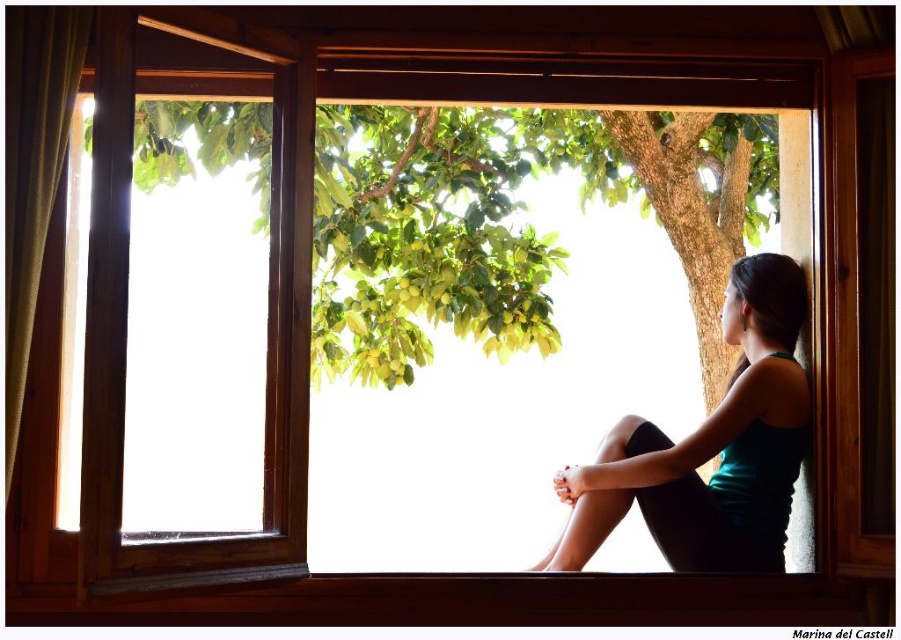
Who is higher up, green leafy tree at center or green textured curtain at left?

green leafy tree at center is higher up.

Is green leafy tree at center closer to the viewer compared to green textured curtain at left?

No, green leafy tree at center is behind green textured curtain at left.

Where is `green leafy tree at center`? The height and width of the screenshot is (640, 901). green leafy tree at center is located at coordinates pyautogui.click(x=512, y=224).

Between green leafy tree at center and teal fabric tank top at right, which one has less height?

teal fabric tank top at right is shorter.

Is green leafy tree at center shorter than teal fabric tank top at right?

No.

At what (x,y) coordinates should I click in order to perform the action: click on green leafy tree at center. Please return your answer as a coordinate pair (x, y). The height and width of the screenshot is (640, 901). Looking at the image, I should click on (512, 224).

Can you confirm if teal fabric tank top at right is positioned above green textured curtain at left?

No, teal fabric tank top at right is not above green textured curtain at left.

Is the position of teal fabric tank top at right less distant than that of green textured curtain at left?

No, teal fabric tank top at right is further to the viewer.

The height and width of the screenshot is (640, 901). What are the coordinates of `teal fabric tank top at right` in the screenshot? It's located at (710, 448).

At what (x,y) coordinates should I click in order to perform the action: click on teal fabric tank top at right. Please return your answer as a coordinate pair (x, y). The image size is (901, 640). Looking at the image, I should click on (710, 448).